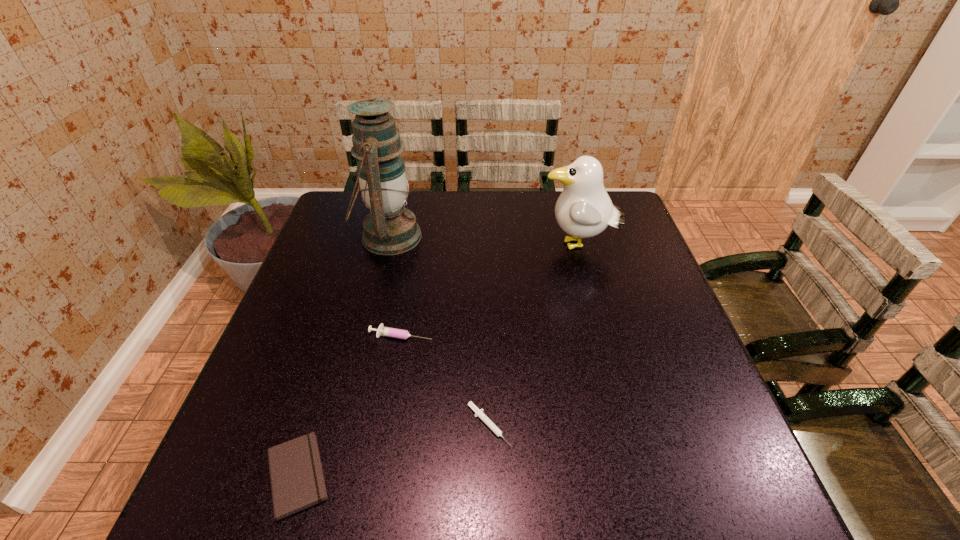
Select which object appears as the fourth closest to the farther syringe. Please provide its 2D coordinates. Your answer should be formatted as a tuple, i.e. [(x, y)], where the tuple contains the x and y coordinates of a point satisfying the conditions above.

[(584, 209)]

You are a GUI agent. You are given a task and a screenshot of the screen. Output one action in this format:
    pyautogui.click(x=<x>, y=<y>)
    Task: Click on the blank area in the image that satisfies the following two spatial constraints: 1. on the back side of the checkbook; 2. on the left side of the left syringe
    
    Given the screenshot: What is the action you would take?
    pyautogui.click(x=340, y=335)

The image size is (960, 540). I want to click on free point that satisfies the following two spatial constraints: 1. on the back side of the shorter syringe; 2. on the left side of the checkbook, so click(x=312, y=426).

Identify the location of vacant region that satisfies the following two spatial constraints: 1. on the beak of the gull; 2. on the front side of the taller syringe. (602, 335).

This screenshot has width=960, height=540. What are the coordinates of `free space in the image that satisfies the following two spatial constraints: 1. on the beak of the gull; 2. on the front side of the fourth object from left to right` in the screenshot? It's located at (626, 426).